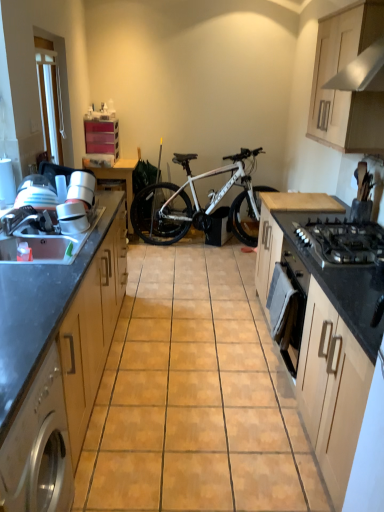
Where is `stainless steel washing machine at left`? stainless steel washing machine at left is located at coordinates (39, 447).

How much space does beige matte cabinet at right, positioned as the second cabinetry in left-to-right order, occupy vertically?

beige matte cabinet at right, positioned as the second cabinetry in left-to-right order, is 35.94 inches tall.

The image size is (384, 512). What do you see at coordinates (343, 242) in the screenshot? I see `black matte gas stove at center right` at bounding box center [343, 242].

Image resolution: width=384 pixels, height=512 pixels. Identify the location of white glossy blender at left. (72, 217).

I want to click on wooden cabinet at left, the 1th cabinetry from the left, so (x=56, y=360).

This screenshot has width=384, height=512. What do you see at coordinates (348, 91) in the screenshot?
I see `wooden cabinet at upper right, the first cabinetry from the right` at bounding box center [348, 91].

Where is `white glossy exhaust hood at upper right`? Image resolution: width=384 pixels, height=512 pixels. white glossy exhaust hood at upper right is located at coordinates (362, 71).

Between wooden cabinet at left, the 3th cabinetry positioned from the right, and stainless steel washing machine at left, which one has smaller size?

stainless steel washing machine at left.

Which of these two, wooden cabinet at left, the 3th cabinetry positioned from the right, or stainless steel washing machine at left, stands shorter?

stainless steel washing machine at left.

Find the location of `kitchen appliance on the right of wooden cabinet at left, the 3th cabinetry positioned from the right`. kitchen appliance on the right of wooden cabinet at left, the 3th cabinetry positioned from the right is located at coordinates (39, 447).

Could you tell me if wooden cabinet at left, the 1th cabinetry from the left, is facing stainless steel washing machine at left?

No, wooden cabinet at left, the 1th cabinetry from the left, is not turned towards stainless steel washing machine at left.

Is point (145, 236) positioned in front of point (309, 245)?

No, (145, 236) is behind (309, 245).

Is white matte bicycle at center not within black matte gas stove at center right?

white matte bicycle at center is positioned outside black matte gas stove at center right.

Consider the image. Which object is thinner, wooden cabinet at upper right, the third cabinetry viewed from the left, or wooden cabinet at left, the 3th cabinetry positioned from the right?

With smaller width is wooden cabinet at upper right, the third cabinetry viewed from the left.

Between wooden cabinet at upper right, the third cabinetry viewed from the left, and wooden cabinet at left, the 3th cabinetry positioned from the right, which one appears on the right side from the viewer's perspective?

From the viewer's perspective, wooden cabinet at upper right, the third cabinetry viewed from the left, appears more on the right side.

Is wooden cabinet at upper right, the third cabinetry viewed from the left, positioned beyond the bounds of wooden cabinet at left, the 3th cabinetry positioned from the right?

Yes, wooden cabinet at upper right, the third cabinetry viewed from the left, is not within wooden cabinet at left, the 3th cabinetry positioned from the right.

Does point (367, 233) come behind point (375, 151)?

No, (367, 233) is closer to viewer.

Looking at their sizes, would you say black matte gas stove at center right is wider or thinner than wooden cabinet at upper right, the first cabinetry from the right?

Considering their sizes, black matte gas stove at center right looks broader than wooden cabinet at upper right, the first cabinetry from the right.

Which is behind, black matte gas stove at center right or wooden cabinet at upper right, the first cabinetry from the right?

wooden cabinet at upper right, the first cabinetry from the right, is more distant.

Considering the sizes of objects black matte gas stove at center right and wooden cabinet at upper right, the first cabinetry from the right, in the image provided, who is taller, black matte gas stove at center right or wooden cabinet at upper right, the first cabinetry from the right,?

wooden cabinet at upper right, the first cabinetry from the right.

From the picture: Can you confirm if stainless steel washing machine at left is positioned to the right of wooden cabinet at left, the 1th cabinetry from the left?

Indeed, stainless steel washing machine at left is positioned on the right side of wooden cabinet at left, the 1th cabinetry from the left.

Looking at this image, how different are the orientations of stainless steel washing machine at left and wooden cabinet at left, the 3th cabinetry positioned from the right, in degrees?

stainless steel washing machine at left and wooden cabinet at left, the 3th cabinetry positioned from the right, are facing 0.137 degrees away from each other.

Is stainless steel washing machine at left positioned with its back to wooden cabinet at left, the 3th cabinetry positioned from the right?

No, stainless steel washing machine at left is not facing the opposite direction of wooden cabinet at left, the 3th cabinetry positioned from the right.

Considering the sizes of objects white glossy blender at left and wooden table at center in the image provided, who is taller, white glossy blender at left or wooden table at center?

wooden table at center.

From a real-world perspective, is white glossy blender at left positioned above or below wooden table at center?

Clearly, from a real-world perspective, white glossy blender at left is above wooden table at center.

Identify the location of appliance above the wooden table at center (from a real-world perspective). (72, 217).

Can you tell me how much white glossy blender at left and wooden table at center differ in facing direction?

The facing directions of white glossy blender at left and wooden table at center are 92.2 degrees apart.

Do you think wooden table at center is within white glossy blender at left, or outside of it?

wooden table at center is spatially situated outside white glossy blender at left.

Is wooden table at center oriented away from white glossy blender at left?

wooden table at center is not turned away from white glossy blender at left.

From the image's perspective, is wooden table at center on white glossy blender at left?

Yes, from the image's perspective, wooden table at center is on top of white glossy blender at left.

Considering the relative sizes of wooden table at center and white glossy blender at left in the image provided, is wooden table at center wider than white glossy blender at left?

Yes, wooden table at center is wider than white glossy blender at left.

Find the location of a particular element. This screenshot has width=384, height=512. kitchen appliance located on the right of wooden cabinet at left, the 3th cabinetry positioned from the right is located at coordinates (39, 447).

I want to click on gas stove above the white matte bicycle at center (from a real-world perspective), so click(343, 242).

Considering their positions, is stainless steel washing machine at left positioned closer to white matte bicycle at center than white glossy exhaust hood at upper right?

Based on the image, white glossy exhaust hood at upper right appears to be nearer to white matte bicycle at center.

Based on their spatial positions, is wooden cabinet at upper right, the third cabinetry viewed from the left, or beige matte cabinet at right, positioned as the second cabinetry in left-to-right order, further from stainless steel washing machine at left?

wooden cabinet at upper right, the third cabinetry viewed from the left, is positioned further to the anchor stainless steel washing machine at left.

Which object lies further to the anchor point wooden cabinet at left, the 3th cabinetry positioned from the right, black matte gas stove at center right or white matte bicycle at center?

white matte bicycle at center lies further to wooden cabinet at left, the 3th cabinetry positioned from the right, than the other object.

Based on their spatial positions, is white glossy blender at left or white matte bicycle at center further from wooden cabinet at upper right, the third cabinetry viewed from the left?

white matte bicycle at center is further to wooden cabinet at upper right, the third cabinetry viewed from the left.

Based on the photo, when comparing their distances from beige matte cabinet at right, positioned as the second cabinetry in left-to-right order, does wooden cabinet at left, the 1th cabinetry from the left, or white matte bicycle at center seem closer?

Based on the image, wooden cabinet at left, the 1th cabinetry from the left, appears to be nearer to beige matte cabinet at right, positioned as the second cabinetry in left-to-right order.

Estimate the real-world distances between objects in this image. Which object is further from wooden table at center, wooden cabinet at upper right, the third cabinetry viewed from the left, or white matte bicycle at center?

wooden cabinet at upper right, the third cabinetry viewed from the left, is further to wooden table at center.

When comparing their distances from stainless steel washing machine at left, does wooden table at center or black matte gas stove at center right seem further?

Among the two, wooden table at center is located further to stainless steel washing machine at left.

Which object lies nearer to the anchor point beige matte cabinet at right, which appears as the 2th cabinetry when viewed from the right, wooden cabinet at left, the 3th cabinetry positioned from the right, or white glossy exhaust hood at upper right?

wooden cabinet at left, the 3th cabinetry positioned from the right, is closer to beige matte cabinet at right, which appears as the 2th cabinetry when viewed from the right.

This screenshot has height=512, width=384. What are the coordinates of `cabinetry located between wooden cabinet at left, the 3th cabinetry positioned from the right, and black matte gas stove at center right in the left-right direction` in the screenshot? It's located at (331, 389).

At what (x,y) coordinates should I click in order to perform the action: click on exhaust hood located between beige matte cabinet at right, positioned as the second cabinetry in left-to-right order, and wooden table at center in the depth direction. Please return your answer as a coordinate pair (x, y). This screenshot has width=384, height=512. Looking at the image, I should click on (362, 71).

At what (x,y) coordinates should I click in order to perform the action: click on table located between beige matte cabinet at right, which appears as the 2th cabinetry when viewed from the right, and white matte bicycle at center in the depth direction. Please return your answer as a coordinate pair (x, y). The image size is (384, 512). Looking at the image, I should click on (115, 180).

Where is `cabinetry between white glossy blender at left and black matte gas stove at center right in the horizontal direction`? The image size is (384, 512). cabinetry between white glossy blender at left and black matte gas stove at center right in the horizontal direction is located at coordinates (331, 389).